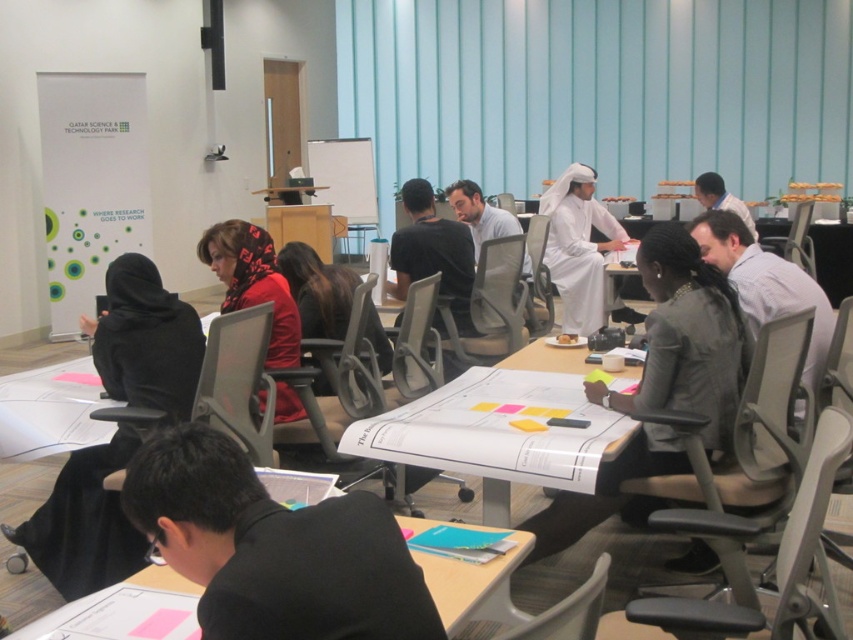
Question: Estimate the real-world distances between objects in this image. Which object is closer to the gray shirt at center?

Choices:
 (A) white paper at lower center
 (B) black matte shirt at lower center
 (C) black fabric abaya at lower left
 (D) silky red dress at center

Answer: (A)

Question: Does white paper at center appear on the right side of matte black chair at center?

Choices:
 (A) yes
 (B) no

Answer: (A)

Question: Can you confirm if white matte robe at center is positioned above white fabric shirt at upper right?

Choices:
 (A) no
 (B) yes

Answer: (A)

Question: Estimate the real-world distances between objects in this image. Which object is farther from the white paper at lower center?

Choices:
 (A) white matte robe at center
 (B) silky red dress at center

Answer: (A)

Question: Can you confirm if gray shirt at center is positioned to the right of white matte robe at center?

Choices:
 (A) yes
 (B) no

Answer: (A)

Question: Which object is farther from the camera taking this photo?

Choices:
 (A) black fabric abaya at lower left
 (B) black matte shirt at center
 (C) white fabric shirt at upper right
 (D) matte black chair at center

Answer: (C)